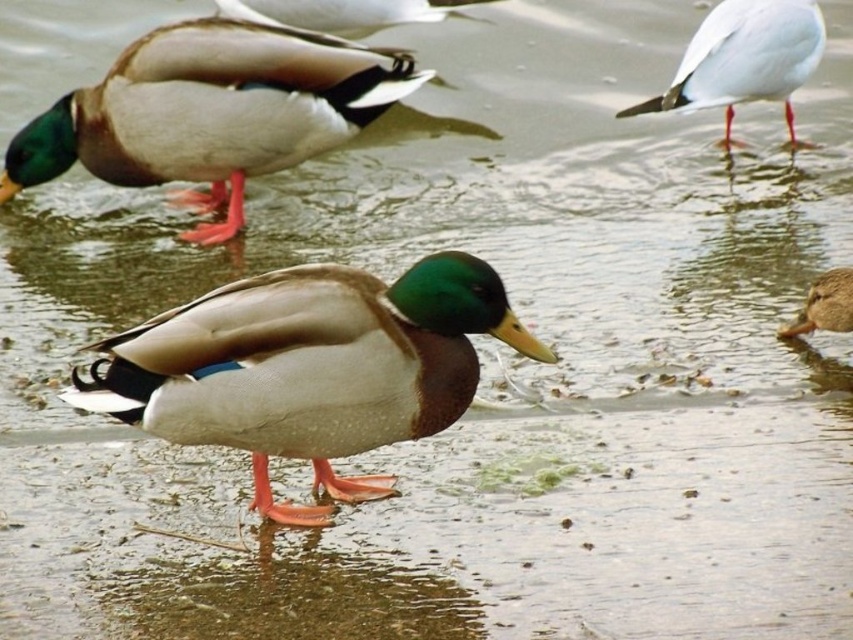
Question: Which point appears closest to the camera in this image?

Choices:
 (A) (850, 330)
 (B) (166, 317)

Answer: (B)

Question: In this image, where is shiny brown duck at upper left located relative to brown matte duck at lower right?

Choices:
 (A) right
 (B) left

Answer: (B)

Question: Which is farther from the shiny brown duck at upper left?

Choices:
 (A) brown matte duck at lower right
 (B) matte brown duck at center
 (C) white matte seagull at upper right

Answer: (A)

Question: Which object is positioned farthest from the shiny brown duck at upper left?

Choices:
 (A) white matte seagull at upper right
 (B) matte brown duck at center

Answer: (B)

Question: Can you confirm if shiny brown duck at upper left is positioned above white matte seagull at upper right?

Choices:
 (A) yes
 (B) no

Answer: (B)

Question: Is shiny brown duck at upper left further to the viewer compared to brown matte duck at lower right?

Choices:
 (A) yes
 (B) no

Answer: (A)